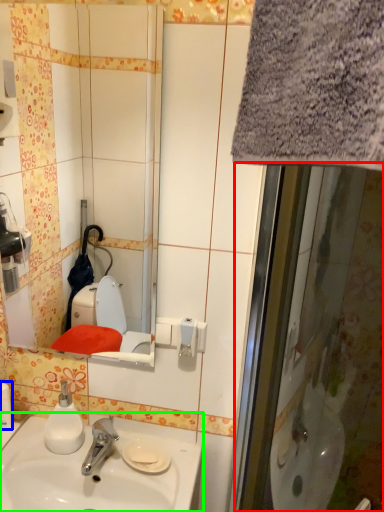
Question: Based on their relative distances, which object is farther from screen door (highlighted by a red box)? Choose from toiletry (highlighted by a blue box) and sink (highlighted by a green box).

Choices:
 (A) toiletry
 (B) sink

Answer: (A)